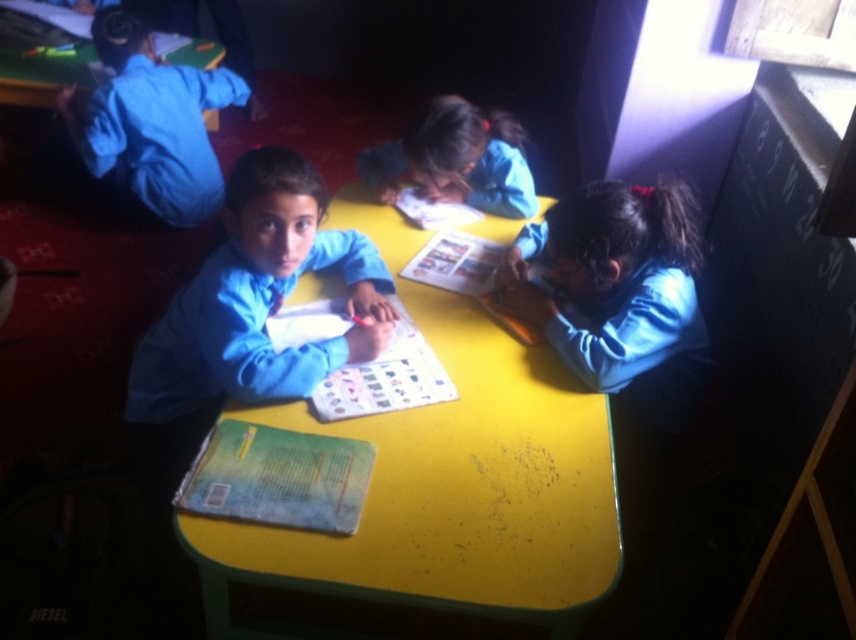
Which is in front, point (679, 390) or point (173, 168)?

Point (679, 390) is in front.

This screenshot has width=856, height=640. I want to click on matte blue uniform at lower right, so click(620, 292).

Is yellow matte table at center thinner than blue uniform shirt at upper left?

Incorrect, yellow matte table at center's width is not less than blue uniform shirt at upper left's.

Who is higher up, yellow matte table at center or blue uniform shirt at upper left?

blue uniform shirt at upper left is above.

Does point (276, 637) come farther from viewer compared to point (84, 115)?

That is False.

At what (x,y) coordinates should I click in order to perform the action: click on yellow matte table at center. Please return your answer as a coordinate pair (x, y). The image size is (856, 640). Looking at the image, I should click on (438, 508).

Who is higher up, matte blue uniform at lower right or blue fabric shirt at center?

blue fabric shirt at center is higher up.

Which is behind, point (623, 253) or point (400, 172)?

The point (400, 172) is behind.

At what (x,y) coordinates should I click in order to perform the action: click on matte blue uniform at lower right. Please return your answer as a coordinate pair (x, y). Looking at the image, I should click on (620, 292).